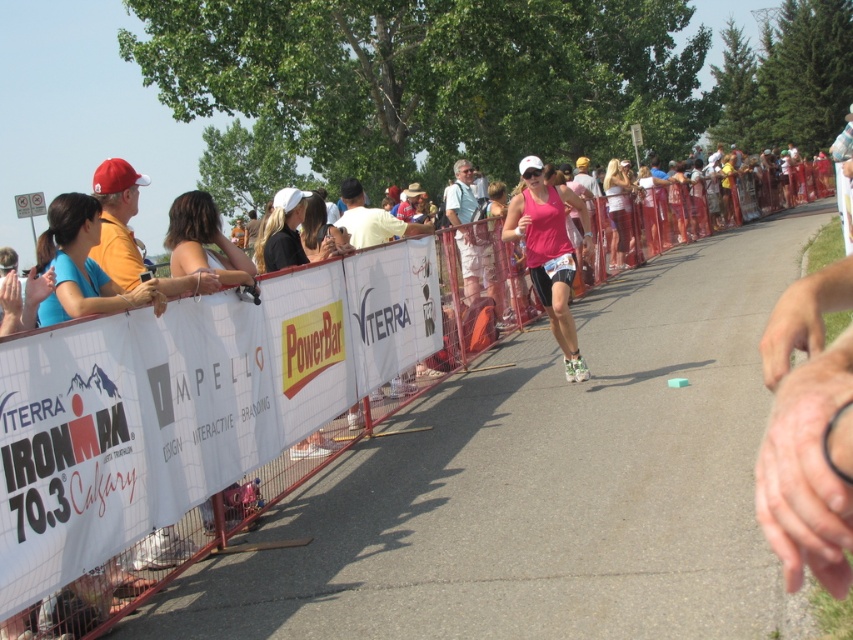
Question: From the image, what is the correct spatial relationship of white plastic barrier at center in relation to pink matte tank top at center?

Choices:
 (A) below
 (B) above

Answer: (B)

Question: Is white plastic barrier at center positioned behind pink matte tank top at center?

Choices:
 (A) yes
 (B) no

Answer: (B)

Question: Which point is closer to the camera?

Choices:
 (A) white plastic barrier at center
 (B) pink matte tank top at center

Answer: (A)

Question: Does white plastic barrier at center appear over pink matte tank top at center?

Choices:
 (A) no
 (B) yes

Answer: (B)

Question: Which object appears closest to the camera in this image?

Choices:
 (A) white plastic barrier at center
 (B) pink matte tank top at center

Answer: (A)